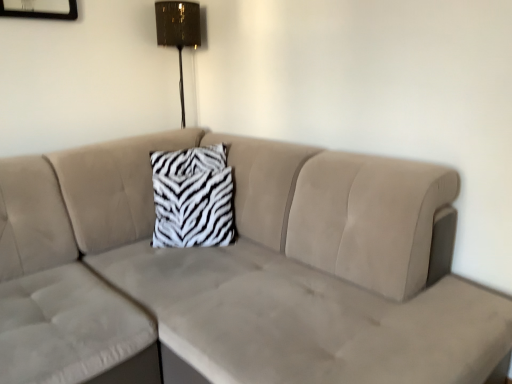
Question: Does metallic gold lampshade at upper center turn towards zebra-patterned fabric pillow at center?

Choices:
 (A) no
 (B) yes

Answer: (A)

Question: Does metallic gold lampshade at upper center have a smaller size compared to zebra-patterned fabric pillow at center?

Choices:
 (A) yes
 (B) no

Answer: (A)

Question: Does metallic gold lampshade at upper center appear on the left side of zebra-patterned fabric pillow at center?

Choices:
 (A) no
 (B) yes

Answer: (B)

Question: Does metallic gold lampshade at upper center have a lesser height compared to zebra-patterned fabric pillow at center?

Choices:
 (A) yes
 (B) no

Answer: (B)

Question: Is zebra-patterned fabric pillow at center inside metallic gold lampshade at upper center?

Choices:
 (A) yes
 (B) no

Answer: (B)

Question: Does metallic gold lampshade at upper center come behind zebra-patterned fabric pillow at center?

Choices:
 (A) yes
 (B) no

Answer: (A)

Question: Are beige velvety couch at center and metallic gold lampshade at upper center beside each other?

Choices:
 (A) no
 (B) yes

Answer: (A)

Question: From a real-world perspective, is beige velvety couch at center positioned under metallic gold lampshade at upper center based on gravity?

Choices:
 (A) yes
 (B) no

Answer: (A)

Question: Is beige velvety couch at center thinner than metallic gold lampshade at upper center?

Choices:
 (A) no
 (B) yes

Answer: (A)

Question: Does beige velvety couch at center lie behind metallic gold lampshade at upper center?

Choices:
 (A) no
 (B) yes

Answer: (A)

Question: Is beige velvety couch at center not inside metallic gold lampshade at upper center?

Choices:
 (A) no
 (B) yes

Answer: (B)

Question: Is beige velvety couch at center smaller than metallic gold lampshade at upper center?

Choices:
 (A) no
 (B) yes

Answer: (A)

Question: From a real-world perspective, is metallic gold lampshade at upper center positioned over beige velvety couch at center based on gravity?

Choices:
 (A) yes
 (B) no

Answer: (A)